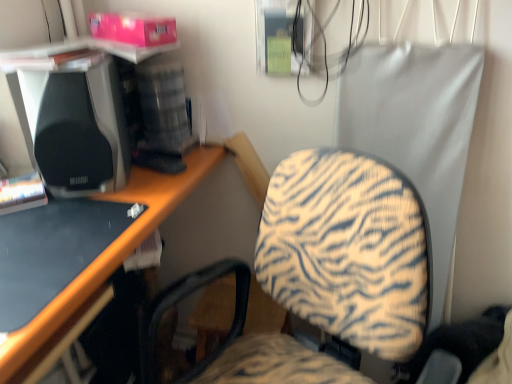
Question: Looking at their shapes, would you say black matte speaker at left is wider or thinner than black glossy desk at lower left?

Choices:
 (A) wide
 (B) thin

Answer: (B)

Question: Is black matte speaker at left in front of or behind black glossy desk at lower left in the image?

Choices:
 (A) front
 (B) behind

Answer: (B)

Question: From a real-world perspective, is black matte speaker at left above or below black glossy desk at lower left?

Choices:
 (A) above
 (B) below

Answer: (A)

Question: From a real-world perspective, is black glossy desk at lower left physically located above or below black matte speaker at left?

Choices:
 (A) below
 (B) above

Answer: (A)

Question: Which is correct: black glossy desk at lower left is inside black matte speaker at left, or outside of it?

Choices:
 (A) inside
 (B) outside

Answer: (B)

Question: In the image, is black glossy desk at lower left positioned in front of or behind black matte speaker at left?

Choices:
 (A) behind
 (B) front

Answer: (B)

Question: Considering the positions of black glossy desk at lower left and black matte speaker at left in the image, is black glossy desk at lower left wider or thinner than black matte speaker at left?

Choices:
 (A) wide
 (B) thin

Answer: (A)